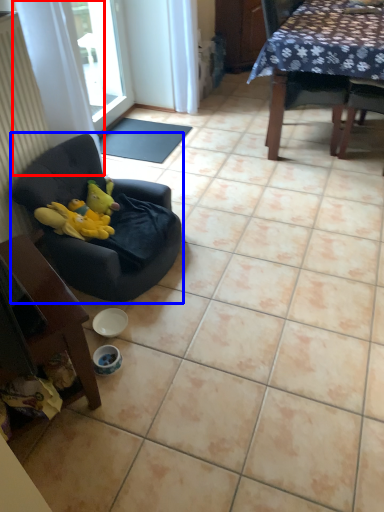
Question: Among these objects, which one is nearest to the camera, curtain (highlighted by a red box) or chair (highlighted by a blue box)?

Choices:
 (A) curtain
 (B) chair

Answer: (B)